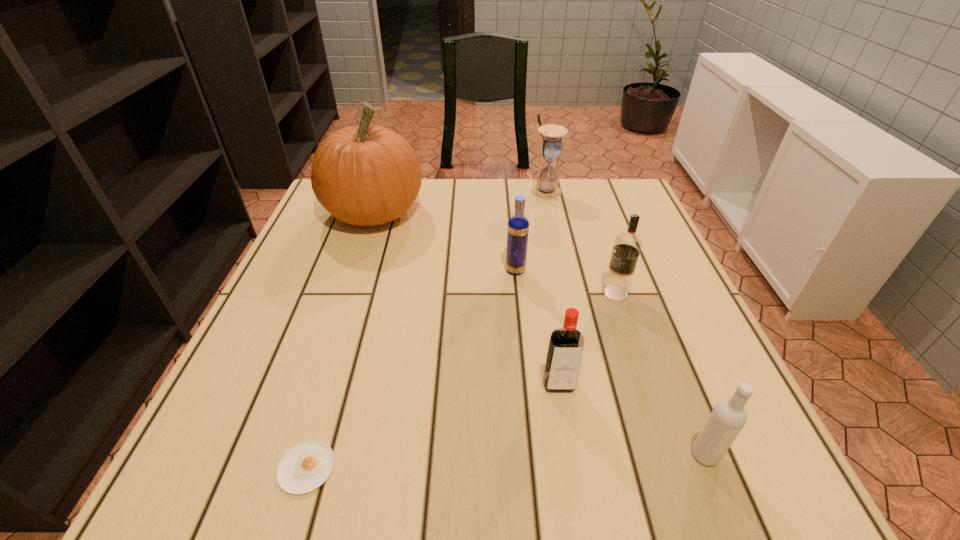
At what (x,y) coordinates should I click in order to perform the action: click on vacant position at the left edge of the desktop. Please return your answer as a coordinate pair (x, y). This screenshot has height=540, width=960. Looking at the image, I should click on (339, 322).

Locate an element on the screen. free space at the right edge of the desktop is located at coordinates (647, 258).

Where is `free point at the far right corner`? free point at the far right corner is located at coordinates (586, 218).

Where is `free space at the near right corner`? free space at the near right corner is located at coordinates (773, 456).

Find the location of a particular element. This screenshot has width=960, height=540. free spot between the hourglass and the egg yolk is located at coordinates (426, 329).

Locate an element on the screen. free space between the rightmost vodka and the third nearest object is located at coordinates (632, 420).

At what (x,y) coordinates should I click in order to perform the action: click on free space between the egg yolk and the third farthest object. Please return your answer as a coordinate pair (x, y). Looking at the image, I should click on (411, 369).

Locate an element on the screen. The height and width of the screenshot is (540, 960). free space between the rightmost vodka and the third object from left to right is located at coordinates (610, 363).

Locate an element on the screen. vacant area between the farthest vodka and the hourglass is located at coordinates (531, 231).

In order to click on unoccupied area between the tallest object and the hourglass in this screenshot , I will do `click(460, 202)`.